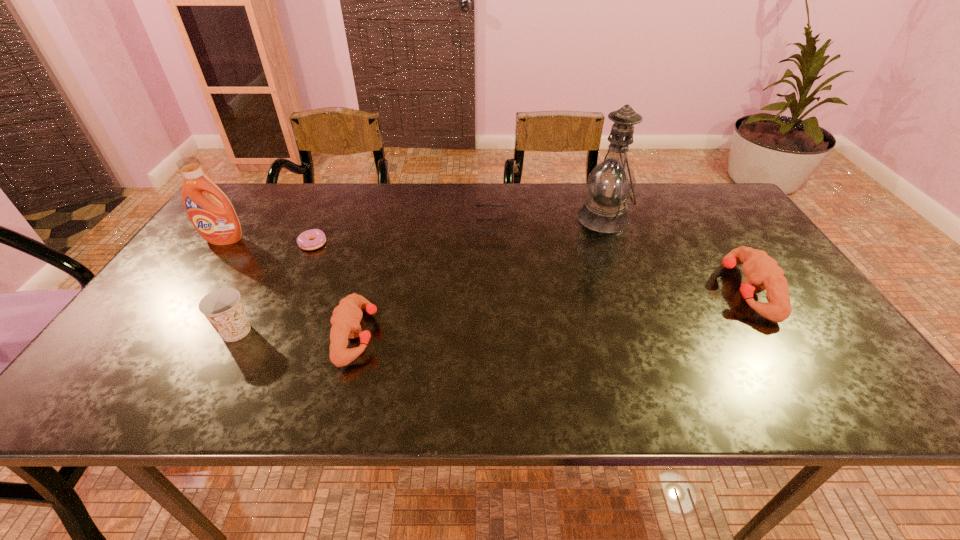
Identify the location of free location located on the front-facing side of the second shortest object. (435, 226).

This screenshot has width=960, height=540. Identify the location of vacant space located on the front-facing side of the second shortest object. (358, 226).

You are a GUI agent. You are given a task and a screenshot of the screen. Output one action in this format:
    pyautogui.click(x=<x>, y=<y>)
    Task: Click on the vacant point located 0.080m on the front-facing side of the detergent
    Image resolution: width=960 pixels, height=540 pixels.
    Given the screenshot: What is the action you would take?
    point(207,264)

You are a GUI agent. You are given a task and a screenshot of the screen. Output one action in this format:
    pyautogui.click(x=<x>, y=<y>)
    Task: Click on the free location located on the back of the second object from left to right
    
    Given the screenshot: What is the action you would take?
    pyautogui.click(x=270, y=268)

Identify the location of oil lamp at the far edge. (611, 182).

In order to click on sunglasses located in the far edge section of the desktop in this screenshot , I will do `click(477, 205)`.

You are a GUI agent. You are given a task and a screenshot of the screen. Output one action in this format:
    pyautogui.click(x=<x>, y=<y>)
    Task: Click on the puncher at the near edge
    The height and width of the screenshot is (540, 960).
    Given the screenshot: What is the action you would take?
    pyautogui.click(x=346, y=318)

Where is `Dixie cup that is at the near edge`? Dixie cup that is at the near edge is located at coordinates (223, 308).

Where is `object situated at the left edge`? object situated at the left edge is located at coordinates (217, 222).

Locate an element on the screen. object that is at the right edge is located at coordinates [762, 272].